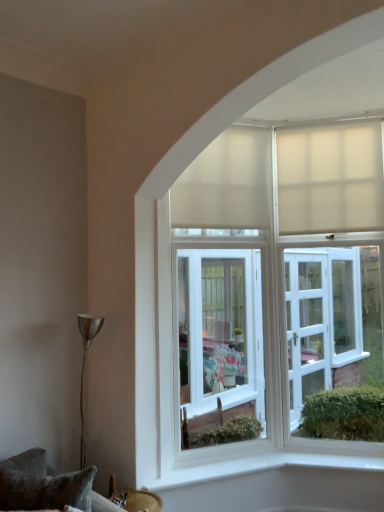
Identify the location of white matte curtain at upper center, which is the first curtain from left to right. The height and width of the screenshot is (512, 384). (226, 183).

Locate an element on the screen. beige matte curtain at upper right, which is the first curtain from right to left is located at coordinates (330, 178).

The width and height of the screenshot is (384, 512). I want to click on velvet cushion at lower left, so click(47, 486).

The width and height of the screenshot is (384, 512). In order to click on white matte curtain at upper center, which is the first curtain from left to right in this screenshot , I will do `click(226, 183)`.

Is velvet cushion at lower left to the left or to the right of white matte curtain at upper center, which is the first curtain from left to right, in the image?

Clearly, velvet cushion at lower left is on the left of white matte curtain at upper center, which is the first curtain from left to right, in the image.

Looking at this image, which is correct: velvet cushion at lower left is inside white matte curtain at upper center, which is the 2th curtain in right-to-left order, or outside of it?

velvet cushion at lower left lies outside white matte curtain at upper center, which is the 2th curtain in right-to-left order.

Can you confirm if velvet cushion at lower left is thinner than white matte curtain at upper center, which is the first curtain from left to right?

Incorrect, the width of velvet cushion at lower left is not less than that of white matte curtain at upper center, which is the first curtain from left to right.

Is white matte curtain at upper center, which is the 2th curtain in right-to-left order, at the right side of velvet cushion at lower left?

Indeed, white matte curtain at upper center, which is the 2th curtain in right-to-left order, is positioned on the right side of velvet cushion at lower left.

Considering the positions of point (220, 209) and point (21, 505), is point (220, 209) closer or farther from the camera than point (21, 505)?

Point (220, 209).

Can you confirm if white matte curtain at upper center, which is the 2th curtain in right-to-left order, is thinner than velvet cushion at lower left?

Correct, the width of white matte curtain at upper center, which is the 2th curtain in right-to-left order, is less than that of velvet cushion at lower left.

Does white matte curtain at upper center, which is the 2th curtain in right-to-left order, lie in front of velvet cushion at lower left?

No, white matte curtain at upper center, which is the 2th curtain in right-to-left order, is further to the viewer.

From the image's perspective, is velvet cushion at lower left on beige matte curtain at upper right, which is the first curtain from right to left?

No, from the image's perspective, velvet cushion at lower left is not over beige matte curtain at upper right, which is the first curtain from right to left.

Can you confirm if velvet cushion at lower left is positioned to the left of beige matte curtain at upper right, the second curtain viewed from the left?

Yes, velvet cushion at lower left is to the left of beige matte curtain at upper right, the second curtain viewed from the left.

Where is `the 2nd curtain to the right of the velvet cushion at lower left, counting from the anchor's position`? the 2nd curtain to the right of the velvet cushion at lower left, counting from the anchor's position is located at coordinates (330, 178).

Which is closer to the camera, (82, 498) or (382, 168)?

Positioned in front is point (82, 498).

Is white matte curtain at upper center, which is the 2th curtain in right-to-left order, not within beige matte curtain at upper right, which is the first curtain from right to left?

white matte curtain at upper center, which is the 2th curtain in right-to-left order, lies outside beige matte curtain at upper right, which is the first curtain from right to left,'s area.

Considering the relative sizes of white matte curtain at upper center, which is the first curtain from left to right, and beige matte curtain at upper right, the second curtain viewed from the left, in the image provided, is white matte curtain at upper center, which is the first curtain from left to right, thinner than beige matte curtain at upper right, the second curtain viewed from the left,?

No, white matte curtain at upper center, which is the first curtain from left to right, is not thinner than beige matte curtain at upper right, the second curtain viewed from the left.

Where is `curtain below the white matte curtain at upper center, which is the first curtain from left to right (from the image's perspective)`? The width and height of the screenshot is (384, 512). curtain below the white matte curtain at upper center, which is the first curtain from left to right (from the image's perspective) is located at coordinates (330, 178).

Between beige matte curtain at upper right, which is the first curtain from right to left, and white matte curtain at upper center, which is the 2th curtain in right-to-left order, which one has larger size?

With larger size is white matte curtain at upper center, which is the 2th curtain in right-to-left order.

Between beige matte curtain at upper right, the second curtain viewed from the left, and white matte curtain at upper center, which is the 2th curtain in right-to-left order, which one is positioned in front?

white matte curtain at upper center, which is the 2th curtain in right-to-left order, is in front.

Looking at their sizes, would you say beige matte curtain at upper right, the second curtain viewed from the left, is wider or thinner than white matte curtain at upper center, which is the 2th curtain in right-to-left order?

In the image, beige matte curtain at upper right, the second curtain viewed from the left, appears to be more narrow than white matte curtain at upper center, which is the 2th curtain in right-to-left order.

How distant is beige matte curtain at upper right, the second curtain viewed from the left, from white matte curtain at upper center, which is the first curtain from left to right?

The distance of beige matte curtain at upper right, the second curtain viewed from the left, from white matte curtain at upper center, which is the first curtain from left to right, is 15.87 inches.

Relative to velvet cushion at lower left, is beige matte curtain at upper right, which is the first curtain from right to left, in front or behind?

beige matte curtain at upper right, which is the first curtain from right to left, is positioned farther from the viewer than velvet cushion at lower left.

Can you tell me how much beige matte curtain at upper right, the second curtain viewed from the left, and velvet cushion at lower left differ in facing direction?

There is a 79.9-degree angle between the facing directions of beige matte curtain at upper right, the second curtain viewed from the left, and velvet cushion at lower left.

In the scene shown: From their relative heights in the image, would you say beige matte curtain at upper right, which is the first curtain from right to left, is taller or shorter than velvet cushion at lower left?

In the image, beige matte curtain at upper right, which is the first curtain from right to left, appears to be taller than velvet cushion at lower left.

Is beige matte curtain at upper right, which is the first curtain from right to left, bigger than velvet cushion at lower left?

No.

There is a velvet cushion at lower left. What are the coordinates of `the 2nd curtain above it (from a real-world perspective)` in the screenshot? It's located at (226, 183).

Identify the location of curtain that is the 2nd object located above the velvet cushion at lower left (from the image's perspective). [x=226, y=183].

Looking at the image, which one is located further to velvet cushion at lower left, beige matte curtain at upper right, which is the first curtain from right to left, or white matte curtain at upper center, which is the 2th curtain in right-to-left order?

beige matte curtain at upper right, which is the first curtain from right to left, is positioned further to the anchor velvet cushion at lower left.

Consider the image. Estimate the real-world distances between objects in this image. Which object is closer to beige matte curtain at upper right, the second curtain viewed from the left, velvet cushion at lower left or white matte curtain at upper center, which is the 2th curtain in right-to-left order?

white matte curtain at upper center, which is the 2th curtain in right-to-left order, is positioned closer to the anchor beige matte curtain at upper right, the second curtain viewed from the left.

Which object lies further to the anchor point beige matte curtain at upper right, the second curtain viewed from the left, white matte curtain at upper center, which is the first curtain from left to right, or velvet cushion at lower left?

Among the two, velvet cushion at lower left is located further to beige matte curtain at upper right, the second curtain viewed from the left.

Considering their positions, is beige matte curtain at upper right, the second curtain viewed from the left, positioned closer to white matte curtain at upper center, which is the first curtain from left to right, than velvet cushion at lower left?

The object closer to white matte curtain at upper center, which is the first curtain from left to right, is beige matte curtain at upper right, the second curtain viewed from the left.

From the image, which object appears to be nearer to velvet cushion at lower left, white matte curtain at upper center, which is the 2th curtain in right-to-left order, or beige matte curtain at upper right, the second curtain viewed from the left?

white matte curtain at upper center, which is the 2th curtain in right-to-left order, is closer to velvet cushion at lower left.

Which object lies nearer to the anchor point white matte curtain at upper center, which is the first curtain from left to right, velvet cushion at lower left or beige matte curtain at upper right, which is the first curtain from right to left?

The object closer to white matte curtain at upper center, which is the first curtain from left to right, is beige matte curtain at upper right, which is the first curtain from right to left.

Where is `curtain between white matte curtain at upper center, which is the 2th curtain in right-to-left order, and velvet cushion at lower left, in the vertical direction`? curtain between white matte curtain at upper center, which is the 2th curtain in right-to-left order, and velvet cushion at lower left, in the vertical direction is located at coordinates (330, 178).